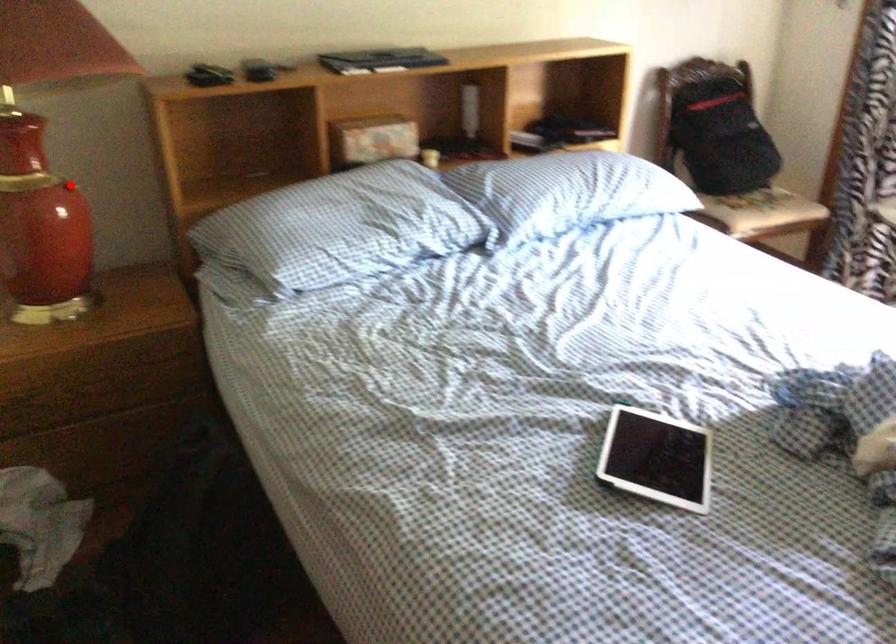
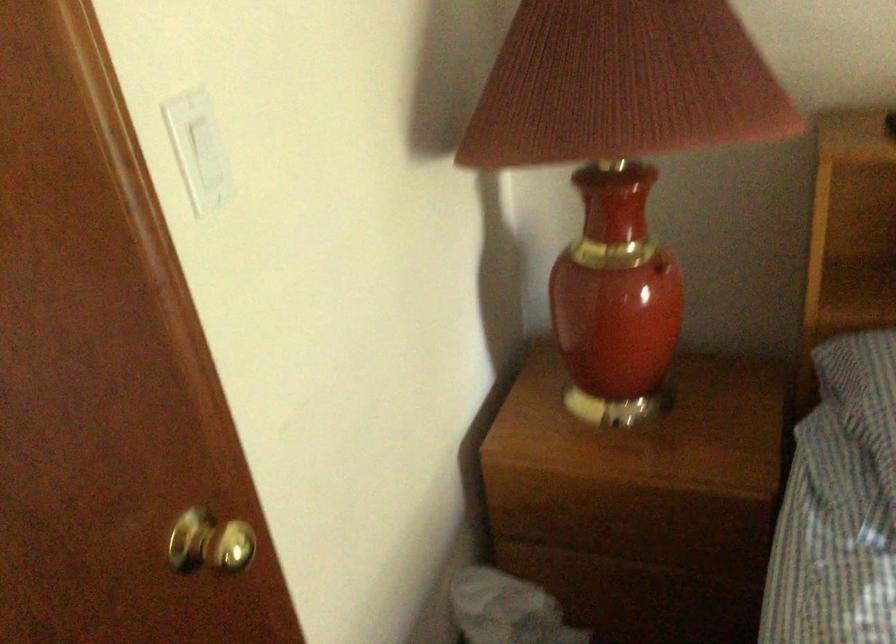
Question: A red point is marked in image1. In image2, is the corresponding 3D point closer to the camera or farther? Reply with the corresponding letter.

Choices:
 (A) The corresponding 3D point is closer.
 (B) The corresponding 3D point is farther.

Answer: (A)